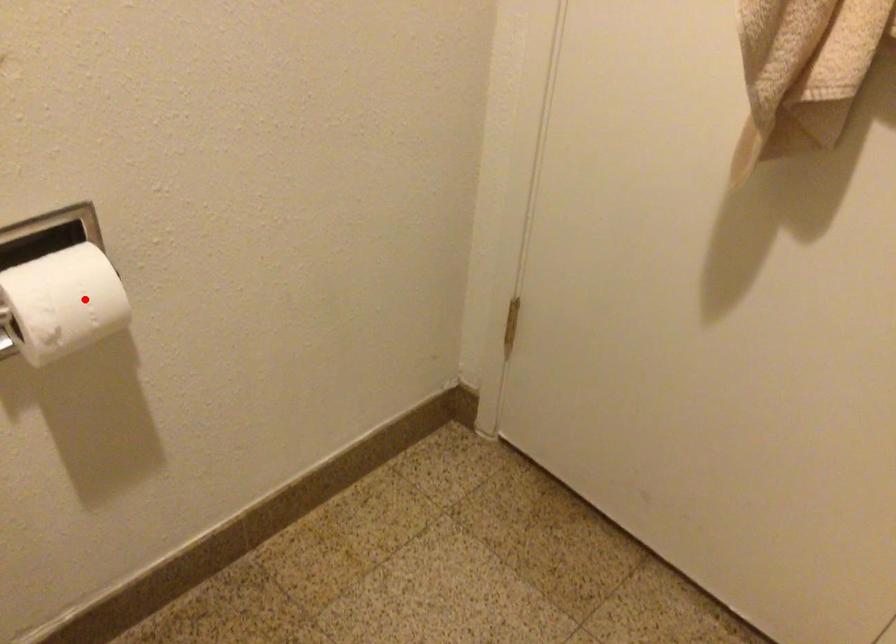
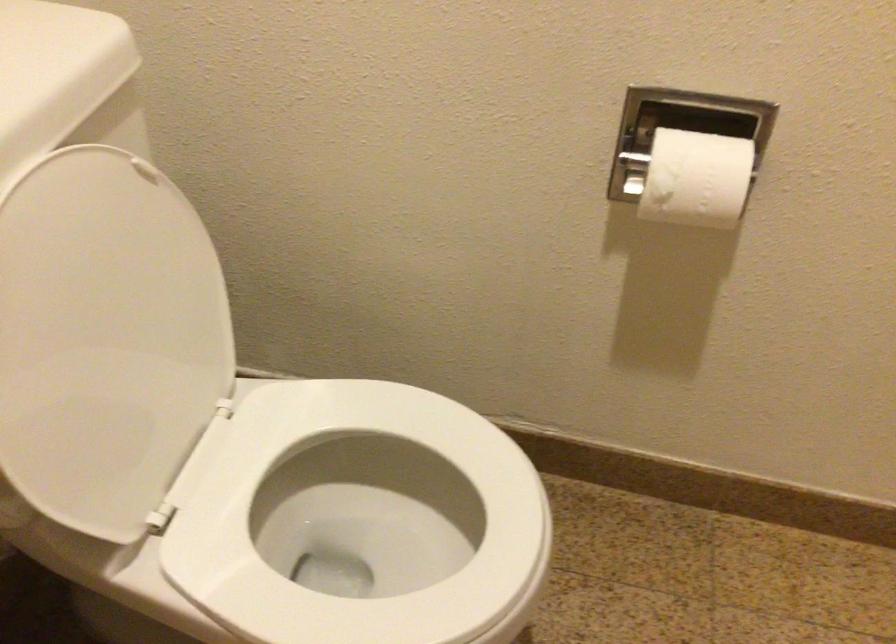
Where in the second image is the point corresponding to the highlighted location from the first image?

(695, 178)